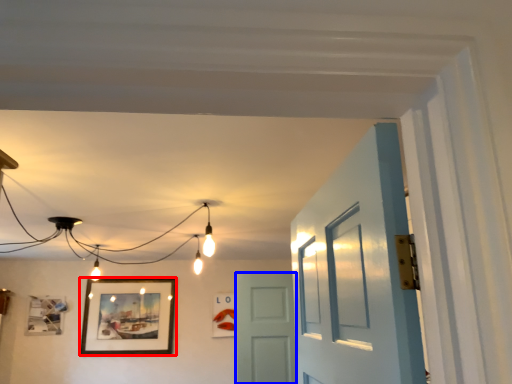
Question: Which object is closer to the camera taking this photo, picture frame (highlighted by a red box) or door (highlighted by a blue box)?

Choices:
 (A) picture frame
 (B) door

Answer: (B)